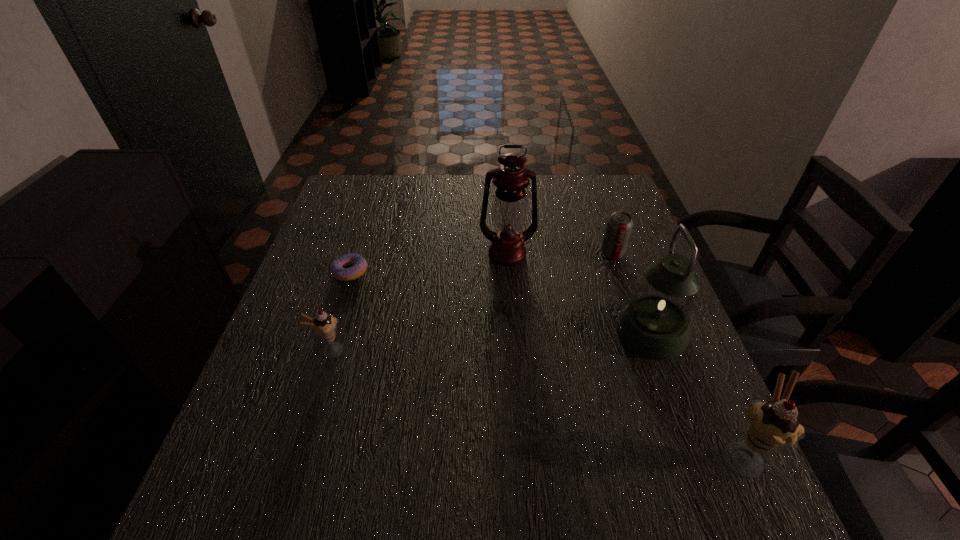
This screenshot has width=960, height=540. What are the coordinates of `free spot located 0.230m on the back of the oil lamp` in the screenshot? It's located at (503, 197).

The height and width of the screenshot is (540, 960). Identify the location of vacant space located 0.370m on the back of the shortest object. (377, 186).

The image size is (960, 540). What are the coordinates of `free spot located 0.270m on the left of the soda can` in the screenshot? It's located at point(500,253).

At what (x,y) coordinates should I click in order to perform the action: click on vacant space located 0.050m on the left of the fifth shortest object. Please return your answer as a coordinate pair (x, y). Image resolution: width=960 pixels, height=540 pixels. Looking at the image, I should click on (594, 332).

Find the location of a particular element. This screenshot has width=960, height=540. object present at the near edge is located at coordinates (772, 425).

The height and width of the screenshot is (540, 960). Find the location of `icecream at the left edge`. icecream at the left edge is located at coordinates (324, 325).

Find the location of a particular element. doughnut that is positioned at the left edge is located at coordinates (359, 265).

You are a GUI agent. You are given a task and a screenshot of the screen. Output one action in this format:
    pyautogui.click(x=<x>, y=<y>)
    Task: Click on the icecream that is at the right edge
    The height and width of the screenshot is (540, 960).
    Given the screenshot: What is the action you would take?
    pyautogui.click(x=772, y=425)

This screenshot has height=540, width=960. In order to click on soda can at the right edge in this screenshot , I will do `click(619, 225)`.

Locate an element on the screen. The width and height of the screenshot is (960, 540). lantern at the right edge is located at coordinates (655, 324).